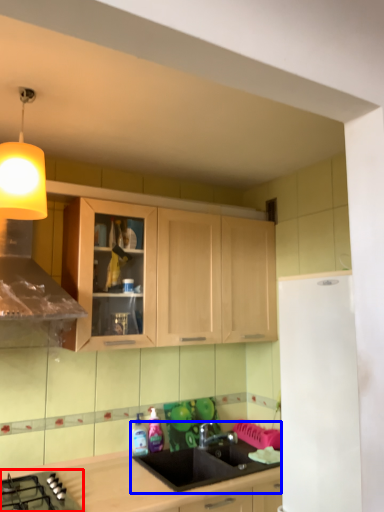
Question: Among these objects, which one is nearest to the camera, gas stove (highlighted by a red box) or sink (highlighted by a blue box)?

Choices:
 (A) gas stove
 (B) sink

Answer: (A)